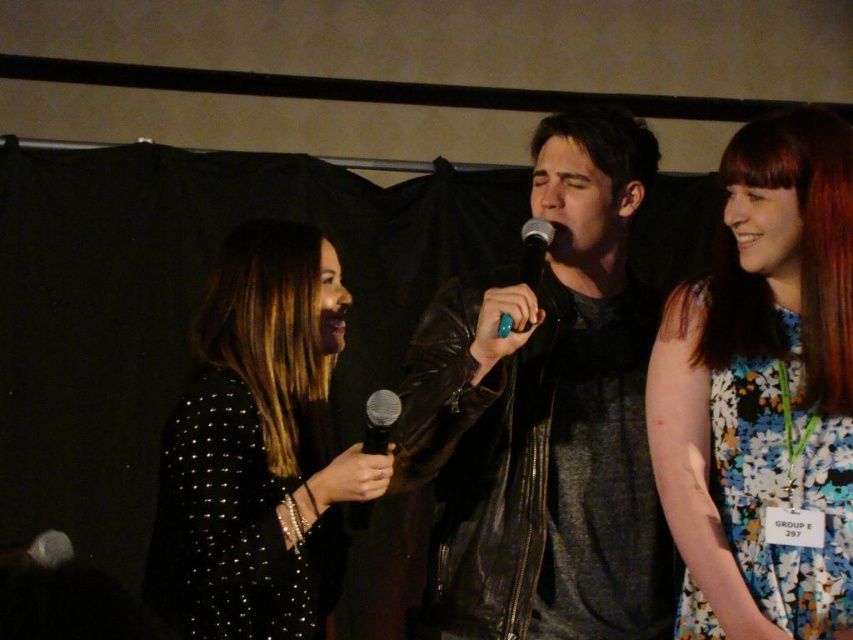
Question: Among these points, which one is farthest from the camera?

Choices:
 (A) (538, 240)
 (B) (625, 449)
 (C) (821, 193)
 (D) (268, 339)

Answer: (D)

Question: Does leather jacket at center have a smaller size compared to floral dress at right?

Choices:
 (A) no
 (B) yes

Answer: (A)

Question: Can you confirm if leather jacket at center is positioned to the left of black sequined dress at left?

Choices:
 (A) no
 (B) yes

Answer: (A)

Question: Based on their relative distances, which object is nearer to the floral dress at right?

Choices:
 (A) matte black microphone at center
 (B) leather jacket at center

Answer: (B)

Question: Which of the following is the closest to the observer?

Choices:
 (A) black matte microphone at center
 (B) black sequined dress at left
 (C) leather jacket at center

Answer: (A)

Question: In this image, where is leather jacket at center located relative to black sequined dress at left?

Choices:
 (A) below
 (B) above

Answer: (B)